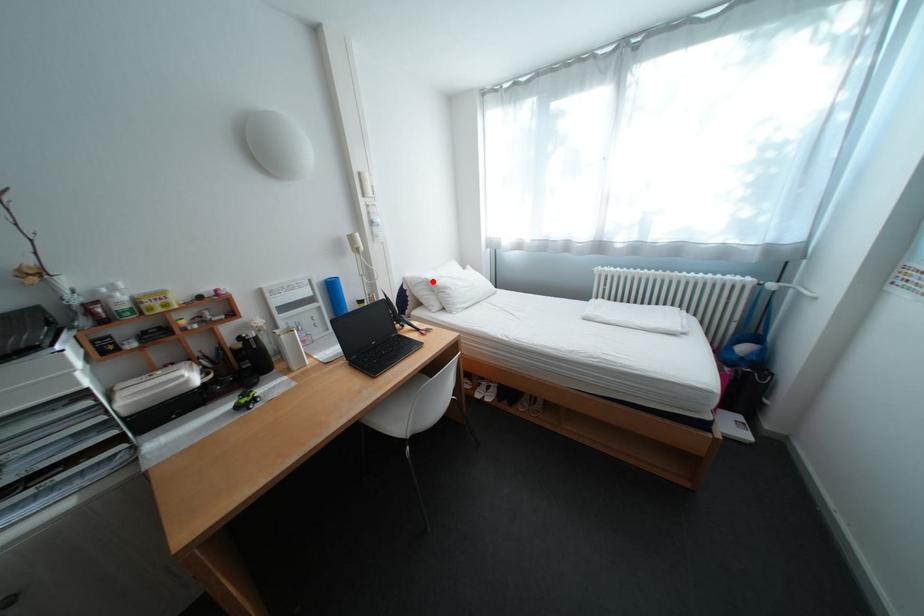
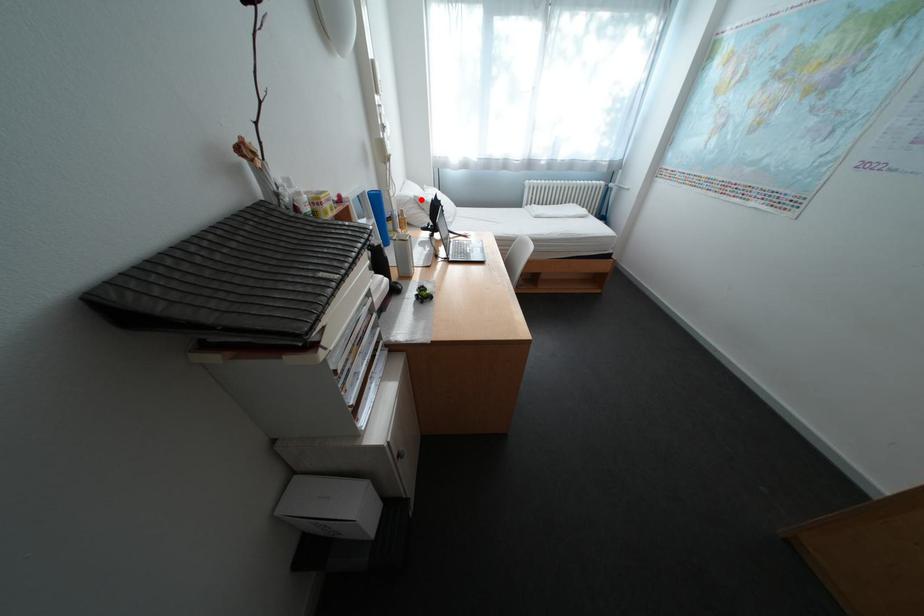
I am providing you with two images of the same scene from different viewpoints. A red point is marked on the first image and another point is marked on the second image. Is the marked point in image1 the same physical position as the marked point in image2?

Yes